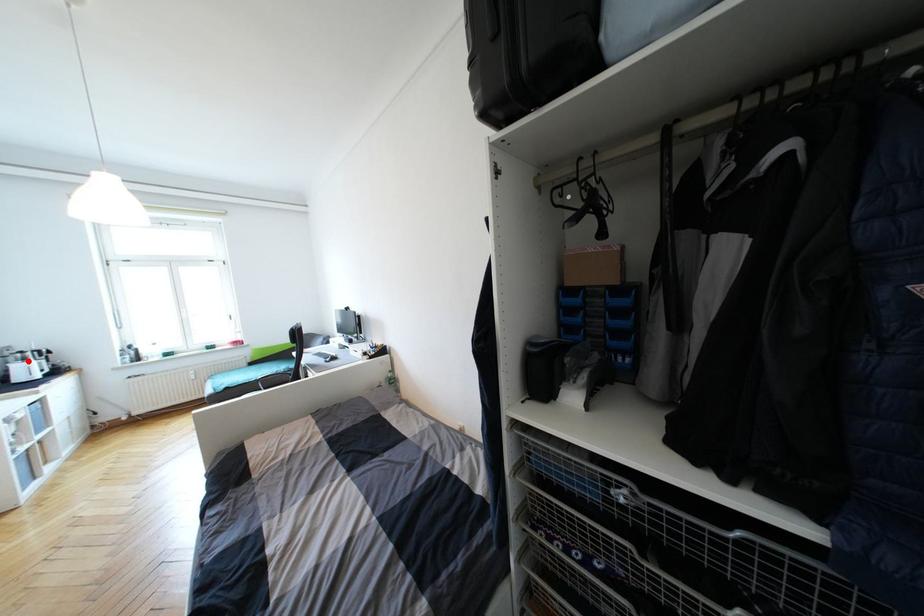
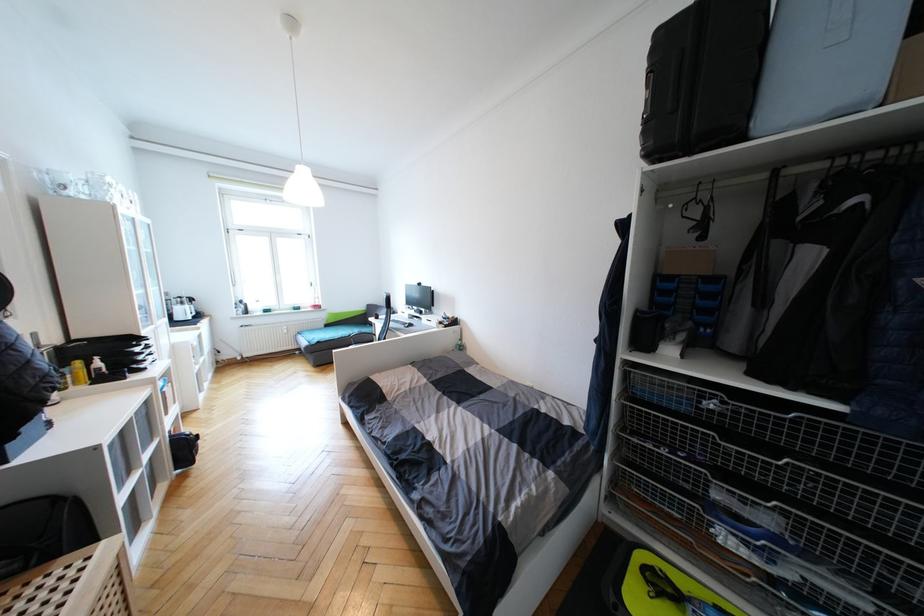
Question: I am providing you with two images of the same scene from different viewpoints. Given a red point in image1, look at the same physical point in image2. Is it:

Choices:
 (A) Closer to the viewpoint
 (B) Farther from the viewpoint

Answer: (A)